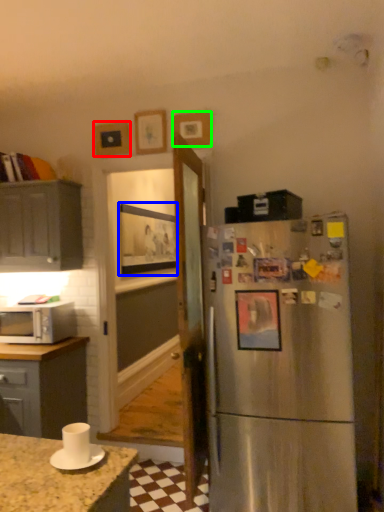
Question: Which object is positioned closest to picture frame (highlighted by a red box)? Select from picture frame (highlighted by a blue box) and picture frame (highlighted by a green box).

Choices:
 (A) picture frame
 (B) picture frame

Answer: (B)